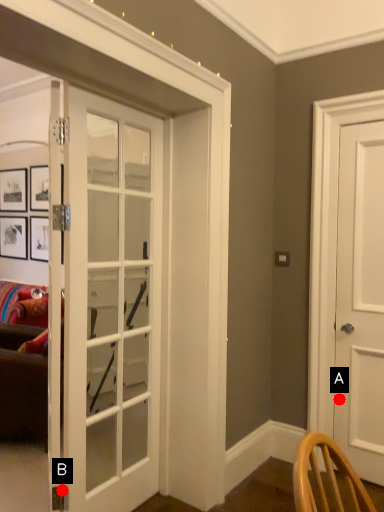
Question: Two points are circled on the image, labeled by A and B beside each circle. Which point is farther to the camera?

Choices:
 (A) A is further
 (B) B is further

Answer: (A)